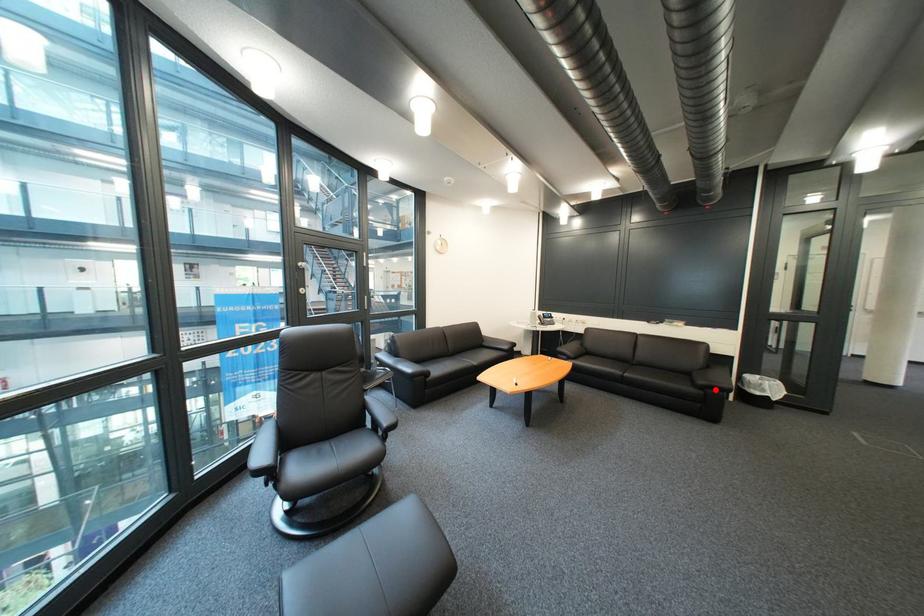
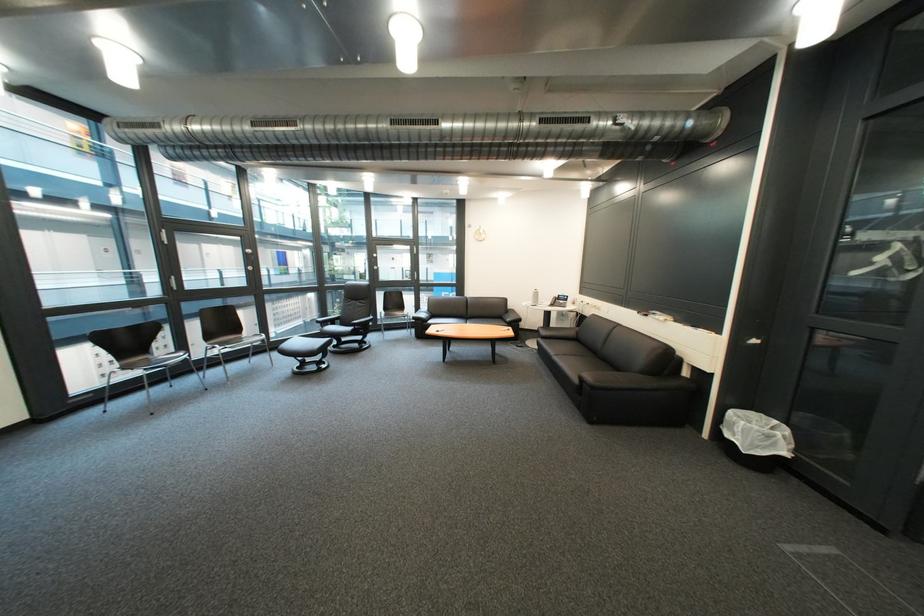
Where in the second image is the point corresponding to the highlighted location from the first image?

(594, 381)